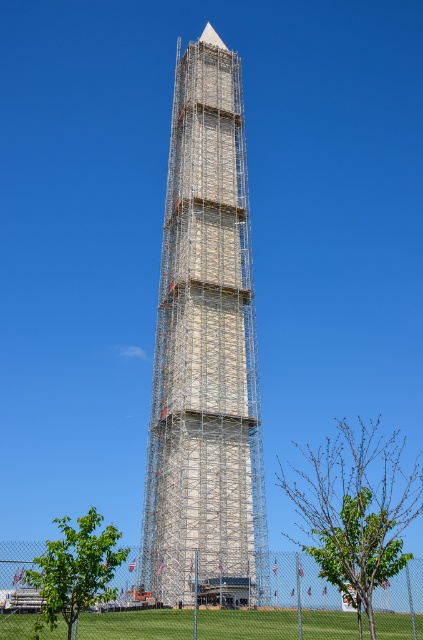
Question: Does silver metallic scaffolding at center appear under green leafy tree at lower left?

Choices:
 (A) yes
 (B) no

Answer: (B)

Question: Among these objects, which one is farthest from the camera?

Choices:
 (A) silver metallic scaffolding at center
 (B) green leafy tree at lower left

Answer: (A)

Question: Which object is positioned farthest from the green leafy tree at lower right?

Choices:
 (A) green leafy tree at lower left
 (B) silver metallic scaffolding at center

Answer: (B)

Question: Is green leafy tree at lower right to the right of green leafy tree at lower left from the viewer's perspective?

Choices:
 (A) yes
 (B) no

Answer: (A)

Question: Which of the following is the closest to the observer?

Choices:
 (A) (68, 538)
 (B) (304, 452)
 (C) (214, 212)

Answer: (A)

Question: Is silver metallic scaffolding at center positioned before green leafy tree at lower right?

Choices:
 (A) no
 (B) yes

Answer: (A)